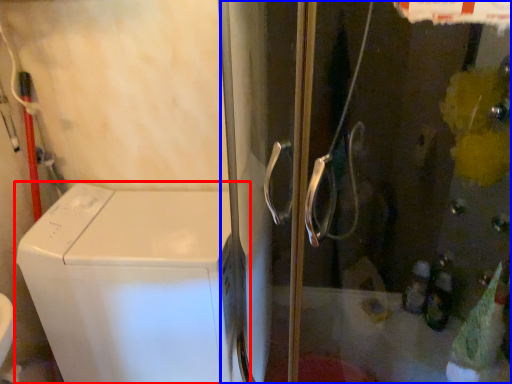
Question: Which of the following is the farthest to the observer, home appliance (highlighted by a red box) or screen door (highlighted by a blue box)?

Choices:
 (A) home appliance
 (B) screen door

Answer: (A)